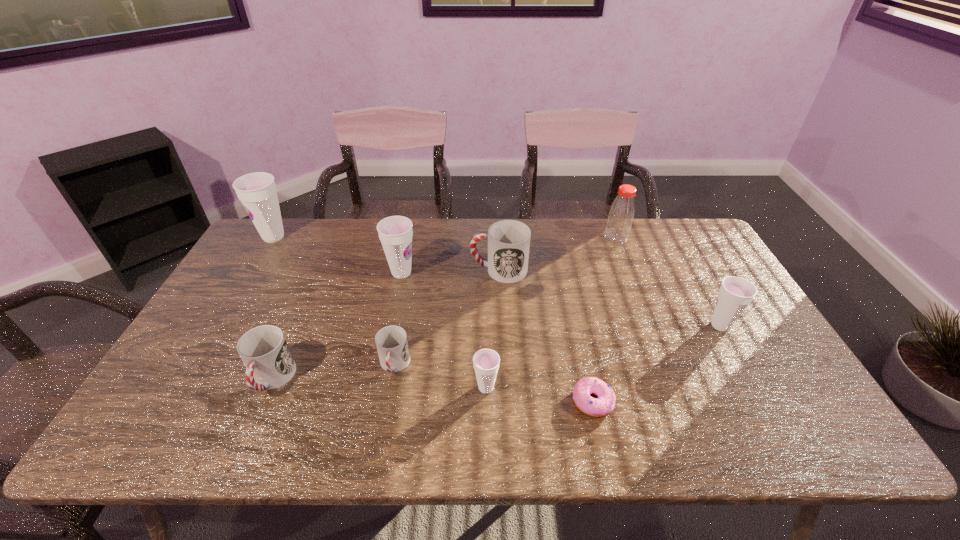
Identify the location of vacant space situated 0.370m on the right of the second purple cup from left to right. This screenshot has height=540, width=960. (536, 273).

Identify the location of vacant space located 0.080m on the side of the rightmost red cup where the handle is located. (444, 270).

The width and height of the screenshot is (960, 540). Identify the location of free region located on the side of the rightmost red cup where the handle is located. (391, 270).

In order to click on vacant area situated on the side of the rightmost red cup where the handle is located in this screenshot , I will do `click(381, 270)`.

Find the location of a particular element. The image size is (960, 540). free space located on the left of the rightmost object is located at coordinates (571, 326).

Where is `free space located 0.400m on the right of the smallest purple cup`? The width and height of the screenshot is (960, 540). free space located 0.400m on the right of the smallest purple cup is located at coordinates (665, 388).

This screenshot has width=960, height=540. I want to click on free space located 0.150m on the side of the second shortest object where the handle is located, so click(380, 441).

Identify the location of free space located on the back of the third object from right to left. (566, 280).

Locate an element on the screen. bottle at the far edge is located at coordinates pyautogui.click(x=622, y=210).

This screenshot has height=540, width=960. In order to click on object located in the near edge section of the desktop in this screenshot , I will do `click(604, 404)`.